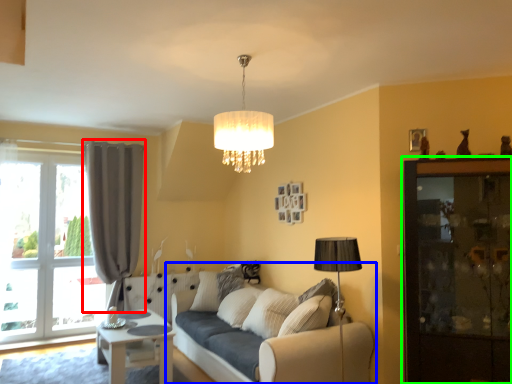
Question: Based on their relative distances, which object is nearer to curtain (highlighted by a red box)? Choose from studio couch (highlighted by a blue box) and dresser (highlighted by a green box).

Choices:
 (A) studio couch
 (B) dresser

Answer: (A)